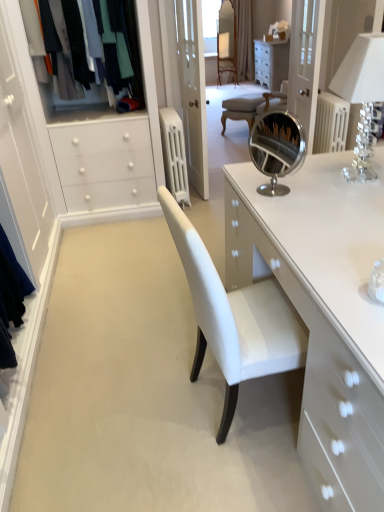
Question: Is point (77, 51) closer or farther from the camera than point (243, 16)?

Choices:
 (A) closer
 (B) farther

Answer: (A)

Question: Considering the positions of matte black clothes at left and beige textured curtain at upper center in the image, is matte black clothes at left bigger or smaller than beige textured curtain at upper center?

Choices:
 (A) small
 (B) big

Answer: (A)

Question: Which is farther from the clear crystal lampshade at upper right?

Choices:
 (A) white painted metal radiator at center
 (B) beige textured curtain at upper center
 (C) clear glass door at upper center
 (D) matte black clothes at left
 (E) white leather chair at center

Answer: (B)

Question: Which is nearer to the white leather chair at center?

Choices:
 (A) clear crystal lampshade at upper right
 (B) clear glass door at upper center
 (C) mahogany wood armchair at upper center
 (D) beige textured curtain at upper center
 (E) matte black clothes at left

Answer: (B)